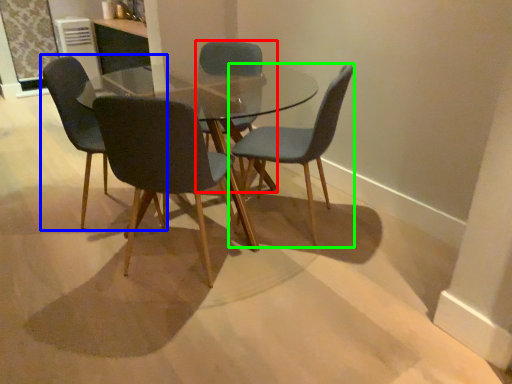
Question: Based on their relative distances, which object is nearer to chair (highlighted by a red box)? Choose from chair (highlighted by a blue box) and chair (highlighted by a green box).

Choices:
 (A) chair
 (B) chair

Answer: (B)